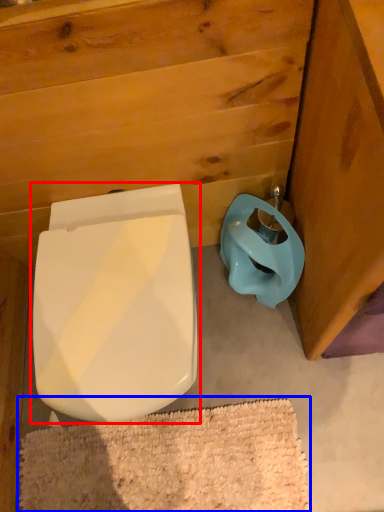
Question: Which object is closer to the camera taking this photo, toilet (highlighted by a red box) or bath mat (highlighted by a blue box)?

Choices:
 (A) toilet
 (B) bath mat

Answer: (A)